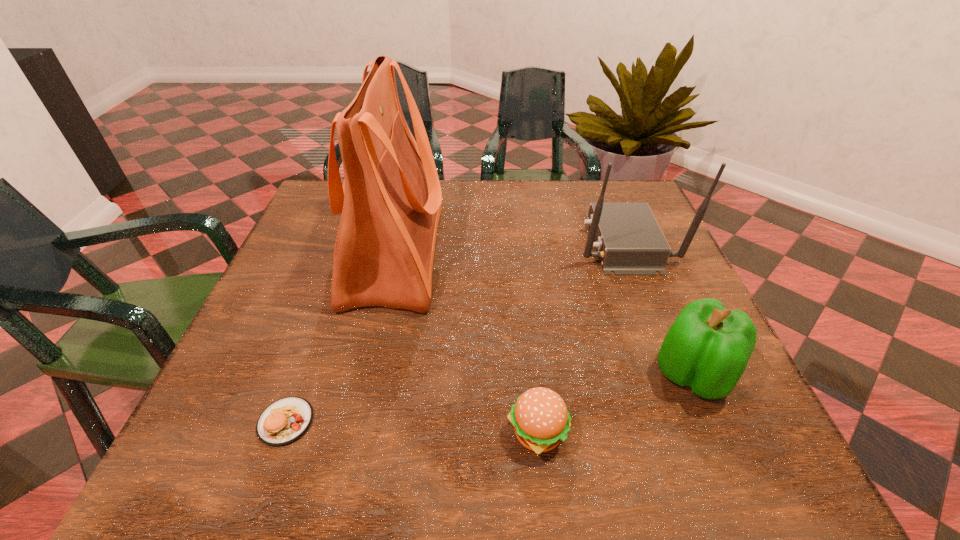
Identify which object is the fourth nearest to the tallest object. Please provide its 2D coordinates. Your answer should be formatted as a tuple, i.e. [(x, y)], where the tuple contains the x and y coordinates of a point satisfying the conditions above.

[(707, 348)]

Image resolution: width=960 pixels, height=540 pixels. Find the location of `free space that satisfies the following two spatial constraints: 1. on the front pocket of the third shortest object; 2. on the right side of the tallest object`. free space that satisfies the following two spatial constraints: 1. on the front pocket of the third shortest object; 2. on the right side of the tallest object is located at coordinates (368, 375).

This screenshot has width=960, height=540. What are the coordinates of `free spot that satisfies the following two spatial constraints: 1. on the back of the router to connect cables; 2. on the front side of the second shortest object` in the screenshot? It's located at (698, 433).

Where is `vacant space that satisfies the following two spatial constraints: 1. on the front pocket of the hamburger; 2. on the left side of the shopping bag`? The image size is (960, 540). vacant space that satisfies the following two spatial constraints: 1. on the front pocket of the hamburger; 2. on the left side of the shopping bag is located at coordinates (354, 433).

Identify the location of free location that satisfies the following two spatial constraints: 1. on the back of the router to connect cables; 2. on the front side of the hamburger. (698, 433).

The image size is (960, 540). In order to click on blank area in the image that satisfies the following two spatial constraints: 1. on the back side of the bell pepper; 2. on the left side of the patty in this screenshot , I will do `click(302, 375)`.

You are a GUI agent. You are given a task and a screenshot of the screen. Output one action in this format:
    pyautogui.click(x=<x>, y=<y>)
    Task: Click on the free space that satisfies the following two spatial constraints: 1. on the front pocket of the tallest object; 2. on the back side of the third tallest object
    Image resolution: width=960 pixels, height=540 pixels.
    Given the screenshot: What is the action you would take?
    pyautogui.click(x=368, y=375)

Identify the location of free region that satisfies the following two spatial constraints: 1. on the front pocket of the shopping bag; 2. on the front side of the shortest object. The height and width of the screenshot is (540, 960). (357, 422).

The width and height of the screenshot is (960, 540). What are the coordinates of `free location that satisfies the following two spatial constraints: 1. on the back of the router to connect cables; 2. on the right side of the bell pepper` in the screenshot? It's located at (675, 375).

Identify the location of vacant space that satisfies the following two spatial constraints: 1. on the front pocket of the tallest object; 2. on the left side of the bell pepper. (368, 375).